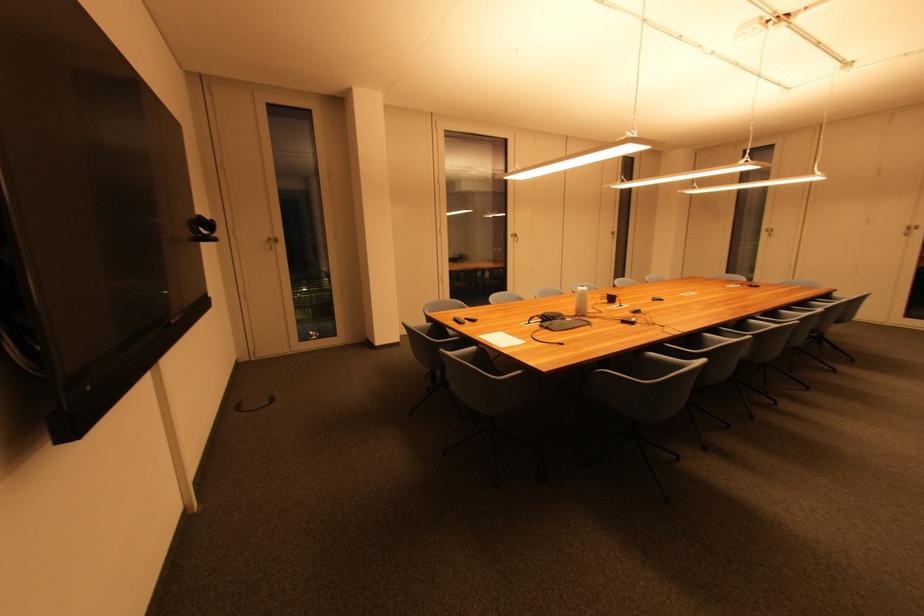
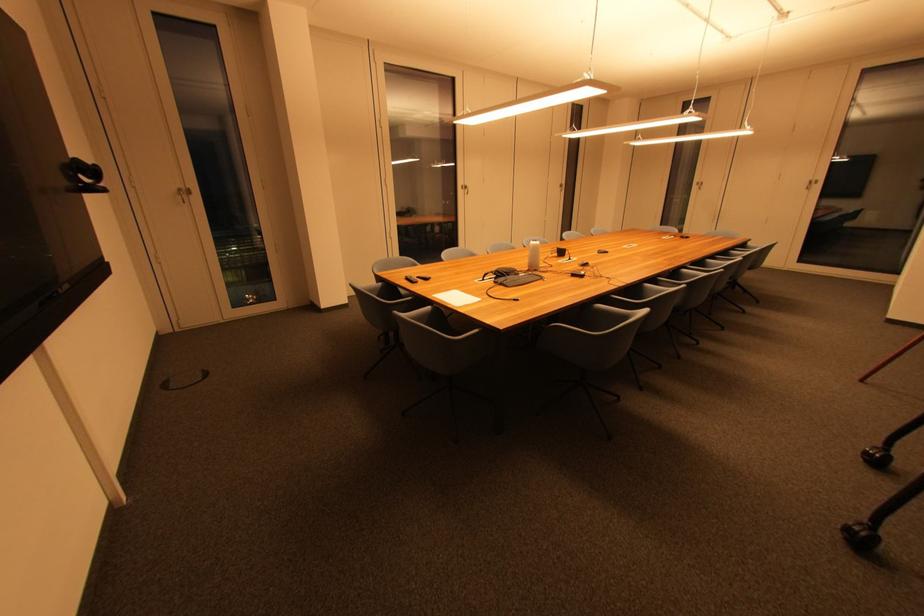
Find the pixel in the second image that matches [217,223] in the first image.

(101, 168)